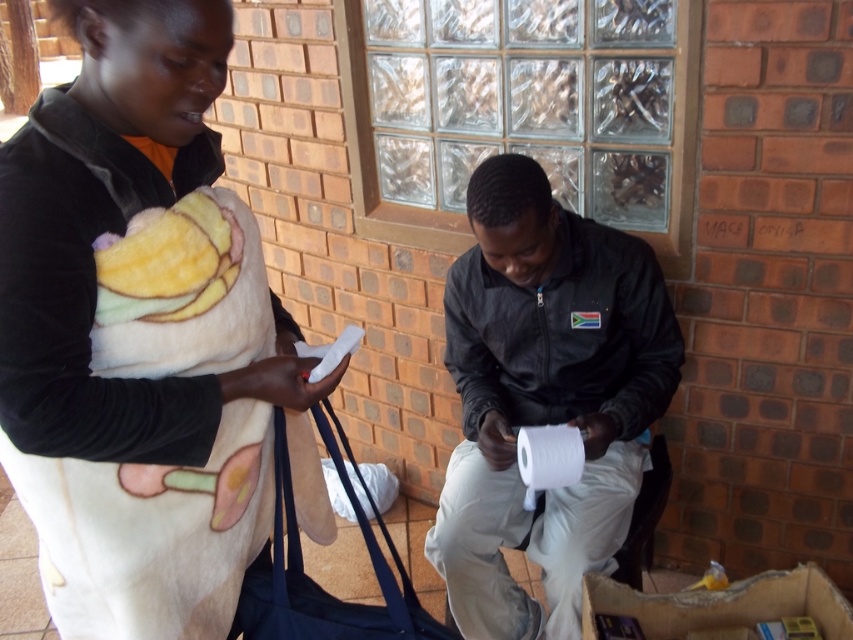
This screenshot has height=640, width=853. What do you see at coordinates (544, 396) in the screenshot?
I see `white matte toilet paper at center` at bounding box center [544, 396].

Is point (592, 541) in front of point (88, 276)?

No, it is behind (88, 276).

You are a GUI agent. You are given a task and a screenshot of the screen. Output one action in this format:
    pyautogui.click(x=<x>, y=<y>)
    Task: Click on the white matte toilet paper at center
    The height and width of the screenshot is (640, 853).
    Given the screenshot: What is the action you would take?
    pyautogui.click(x=544, y=396)